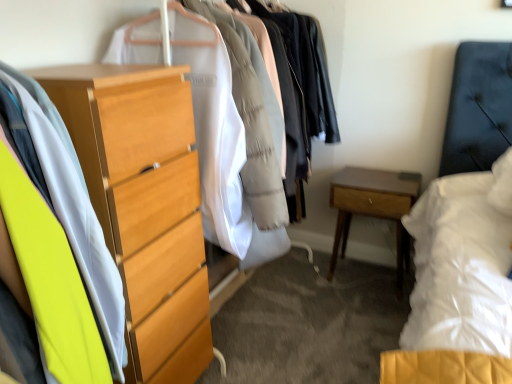
Question: Is light wood dresser at left, which is the second closet in back-to-front order, positioned far away from light wood chest of drawers at left?

Choices:
 (A) yes
 (B) no

Answer: (B)

Question: From the image's perspective, is light wood dresser at left, which is counted as the 1th closet, starting from the front, beneath light wood chest of drawers at left?

Choices:
 (A) no
 (B) yes

Answer: (A)

Question: Is light wood dresser at left, which is counted as the 1th closet, starting from the front, smaller than light wood chest of drawers at left?

Choices:
 (A) no
 (B) yes

Answer: (A)

Question: From a real-world perspective, is light wood dresser at left, which is the second closet in back-to-front order, below light wood chest of drawers at left?

Choices:
 (A) no
 (B) yes

Answer: (A)

Question: Considering the relative sizes of light wood dresser at left, which is the second closet in back-to-front order, and light wood chest of drawers at left in the image provided, is light wood dresser at left, which is the second closet in back-to-front order, bigger than light wood chest of drawers at left?

Choices:
 (A) yes
 (B) no

Answer: (A)

Question: Which is correct: light wood dresser at left, which is counted as the 1th closet, starting from the front, is inside light wood chest of drawers at left, or outside of it?

Choices:
 (A) outside
 (B) inside

Answer: (A)

Question: From a real-world perspective, is light wood dresser at left, which is the second closet in back-to-front order, positioned above or below light wood chest of drawers at left?

Choices:
 (A) above
 (B) below

Answer: (A)

Question: In terms of height, does light wood dresser at left, which is the second closet in back-to-front order, look taller or shorter compared to light wood chest of drawers at left?

Choices:
 (A) tall
 (B) short

Answer: (A)

Question: Considering the positions of point (115, 155) and point (157, 340), is point (115, 155) closer or farther from the camera than point (157, 340)?

Choices:
 (A) closer
 (B) farther

Answer: (A)

Question: Considering the positions of light wood chest of drawers at left and light brown wood nightstand at lower right in the image, is light wood chest of drawers at left taller or shorter than light brown wood nightstand at lower right?

Choices:
 (A) short
 (B) tall

Answer: (B)

Question: Visually, is light wood chest of drawers at left positioned to the left or to the right of light brown wood nightstand at lower right?

Choices:
 (A) left
 (B) right

Answer: (A)

Question: Is point (152, 329) closer or farther from the camera than point (367, 215)?

Choices:
 (A) closer
 (B) farther

Answer: (A)

Question: In the image, is light wood chest of drawers at left positioned in front of or behind light brown wood nightstand at lower right?

Choices:
 (A) behind
 (B) front

Answer: (B)

Question: From a real-world perspective, relative to light wood chest of drawers at left, is light brown wood nightstand at lower right vertically above or below?

Choices:
 (A) above
 (B) below

Answer: (B)

Question: Considering the positions of light brown wood nightstand at lower right and light wood chest of drawers at left in the image, is light brown wood nightstand at lower right bigger or smaller than light wood chest of drawers at left?

Choices:
 (A) small
 (B) big

Answer: (A)